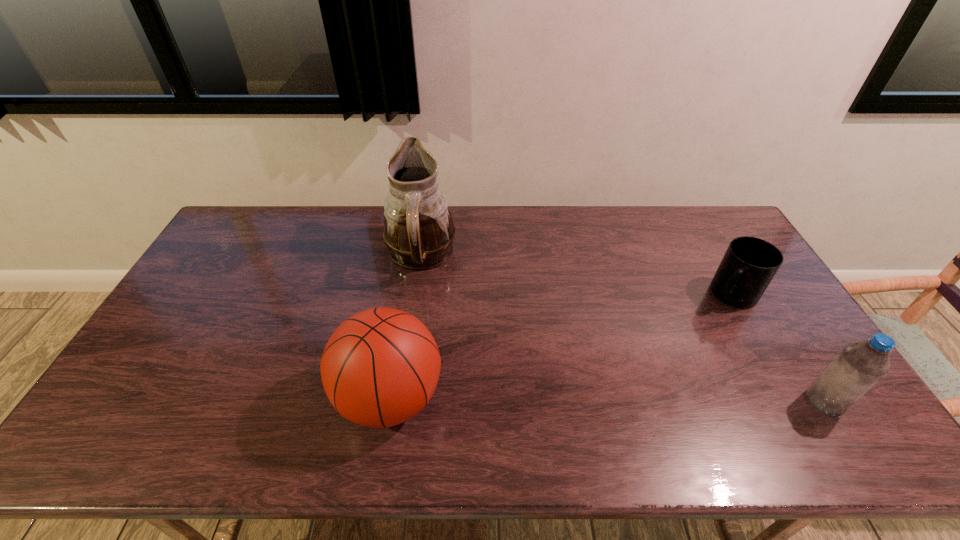
At what (x,y) coordinates should I click in order to perform the action: click on vacant space at the left edge of the desktop. Please return your answer as a coordinate pair (x, y). The image size is (960, 540). Looking at the image, I should click on (155, 339).

Find the location of a particular element. blank area at the right edge is located at coordinates (815, 349).

This screenshot has width=960, height=540. Identify the location of vacant region at the far left corner of the desktop. (238, 222).

The image size is (960, 540). I want to click on vacant space at the far right corner, so click(x=717, y=208).

Find the location of `vacant space at the near right corner of the desktop`. vacant space at the near right corner of the desktop is located at coordinates (812, 409).

At what (x,y) coordinates should I click in order to perform the action: click on unoccupied position between the water bottle and the pitcher. Please return your answer as a coordinate pair (x, y). The width and height of the screenshot is (960, 540). Looking at the image, I should click on (622, 329).

The width and height of the screenshot is (960, 540). In order to click on unoccupied position between the tallest object and the mug in this screenshot , I will do `click(576, 276)`.

Where is `empty location between the basketball and the water bottle`? Image resolution: width=960 pixels, height=540 pixels. empty location between the basketball and the water bottle is located at coordinates (607, 400).

You are a GUI agent. You are given a task and a screenshot of the screen. Output one action in this format:
    pyautogui.click(x=<x>, y=<y>)
    Task: Click on the vacant region between the shortest object and the water bottle
    Image resolution: width=960 pixels, height=540 pixels.
    Given the screenshot: What is the action you would take?
    pyautogui.click(x=778, y=348)

I want to click on free space between the tallest object and the water bottle, so click(622, 329).